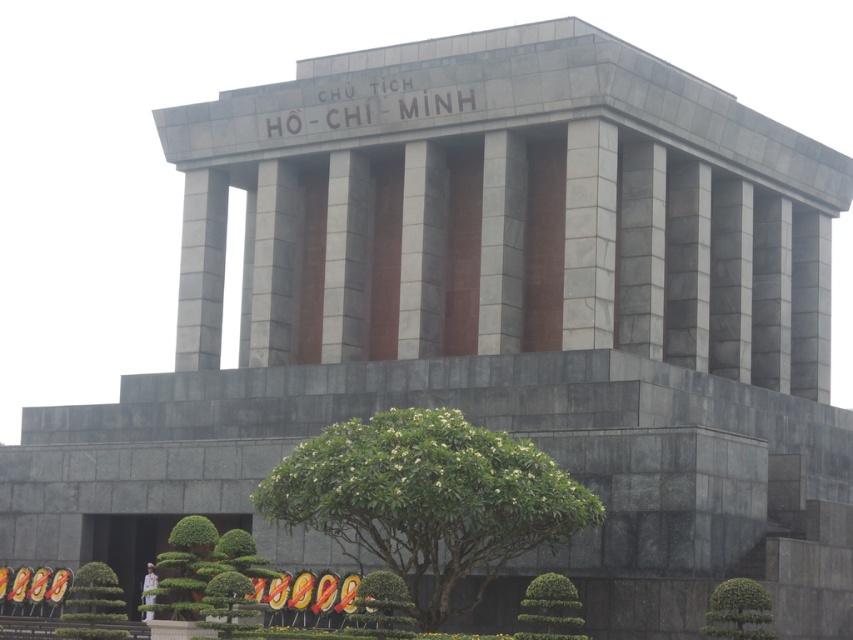
Question: Can you confirm if green leafy tree at center is positioned below green leafy hedge at lower right?

Choices:
 (A) yes
 (B) no

Answer: (B)

Question: Which object is closer to the camera taking this photo?

Choices:
 (A) green leafy tree at center
 (B) green leafy hedge at lower right
 (C) green leafy hedge at lower center

Answer: (A)

Question: Which object appears farthest from the camera in this image?

Choices:
 (A) green leafy hedge at lower right
 (B) green leafy tree at center

Answer: (A)

Question: Which object is closer to the camera taking this photo?

Choices:
 (A) green leafy hedge at lower center
 (B) green leafy hedge at lower right
 (C) green leafy tree at center

Answer: (C)

Question: Is green leafy hedge at lower right to the right of green leafy hedge at lower center from the viewer's perspective?

Choices:
 (A) no
 (B) yes

Answer: (B)

Question: Is green leafy tree at center further to the viewer compared to green leafy hedge at lower right?

Choices:
 (A) yes
 (B) no

Answer: (B)